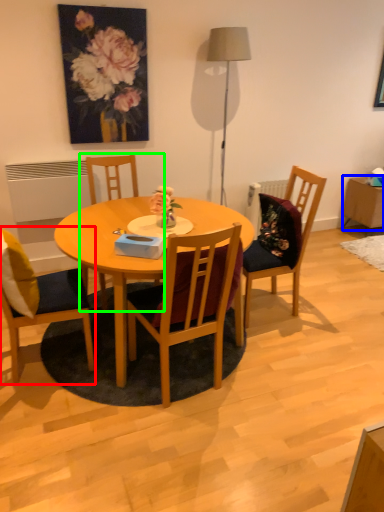
Question: Which object is the farthest from chair (highlighted by a red box)? Choose among these: side table (highlighted by a blue box) or chair (highlighted by a green box).

Choices:
 (A) side table
 (B) chair

Answer: (A)